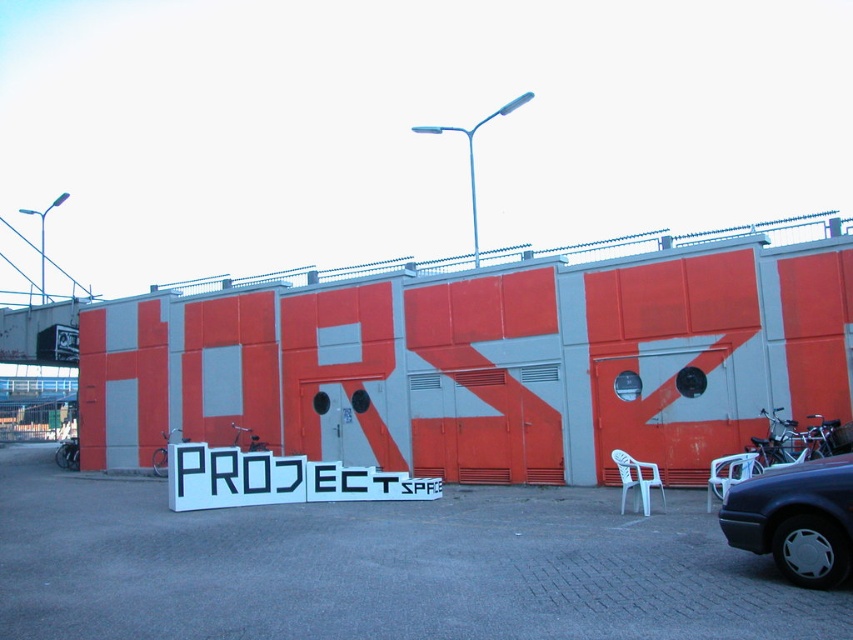
Question: Is gray concrete parking lot at center wider than dark gray metallic car at lower right?

Choices:
 (A) yes
 (B) no

Answer: (A)

Question: From the image, what is the correct spatial relationship of gray concrete parking lot at center in relation to dark gray metallic car at lower right?

Choices:
 (A) right
 (B) left

Answer: (B)

Question: Which of the following is the closest to the observer?

Choices:
 (A) (834, 572)
 (B) (103, 492)

Answer: (A)

Question: Which point is closer to the camera?

Choices:
 (A) (764, 548)
 (B) (753, 628)

Answer: (B)

Question: Is gray concrete parking lot at center to the left of dark gray metallic car at lower right from the viewer's perspective?

Choices:
 (A) yes
 (B) no

Answer: (A)